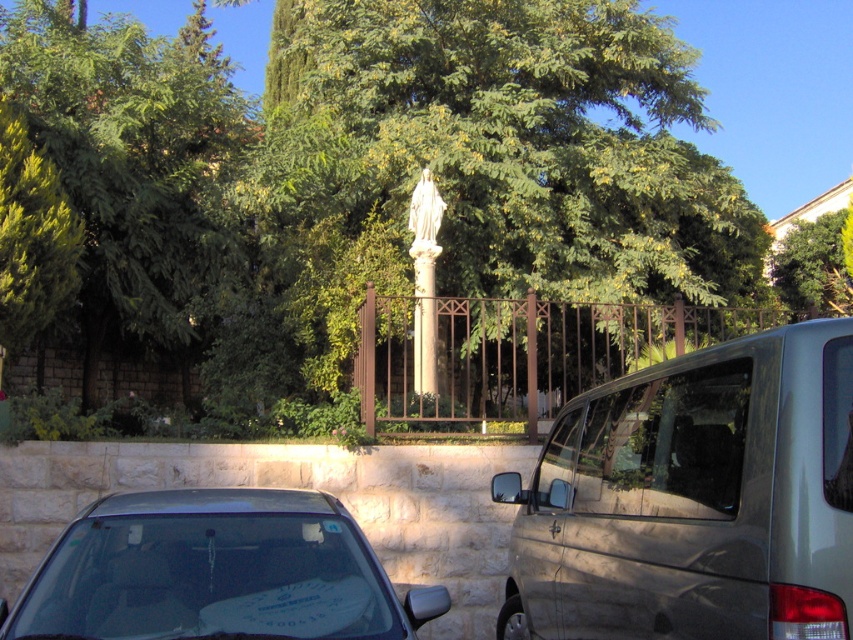
You are standing at the entrance of the fenced area and want to take a photo of the statue. However, the green leafy tree at center and the matte black car at lower left are blocking your view. Which object is closer to you, making it the main obstruction?

The matte black car at lower left is behind the green leafy tree at center, so the green leafy tree at center is closer to you and is the main obstruction.

You are standing at the entrance of the fenced area where the statue is located. You need to park your car in the nearest available spot. Which vehicle, the satin silver van at center or the smaller car on the left, is closer to the entrance?

The satin silver van at center is located at point (692, 497), which is closer to the entrance than the smaller car on the left, so the satin silver van at center is the nearest available spot.